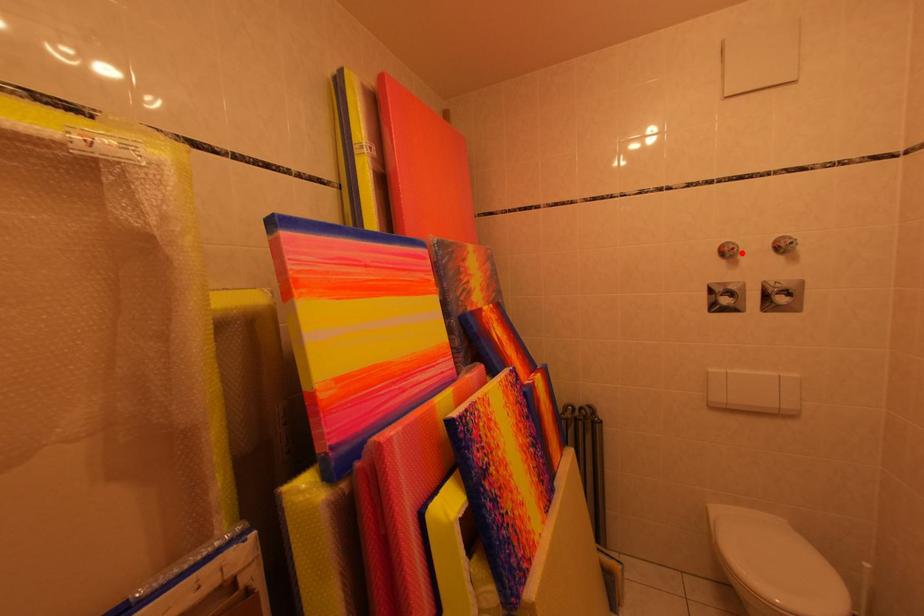
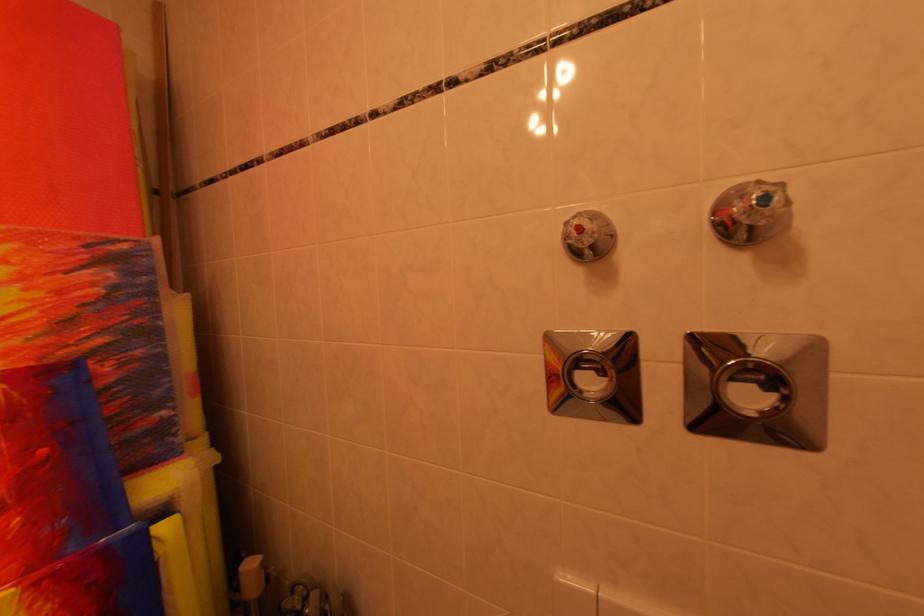
In the second image, find the point that corresponds to the highlighted location in the first image.

(589, 232)